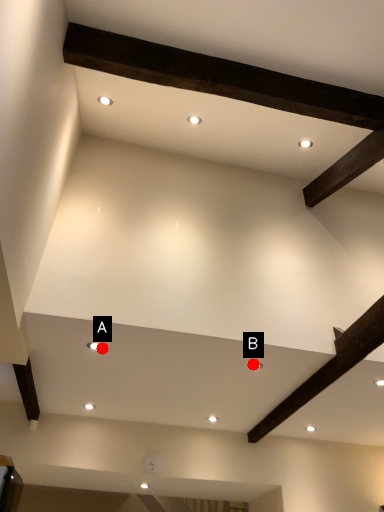
Question: Two points are circled on the image, labeled by A and B beside each circle. Which point appears closest to the camera in this image?

Choices:
 (A) A is closer
 (B) B is closer

Answer: (A)